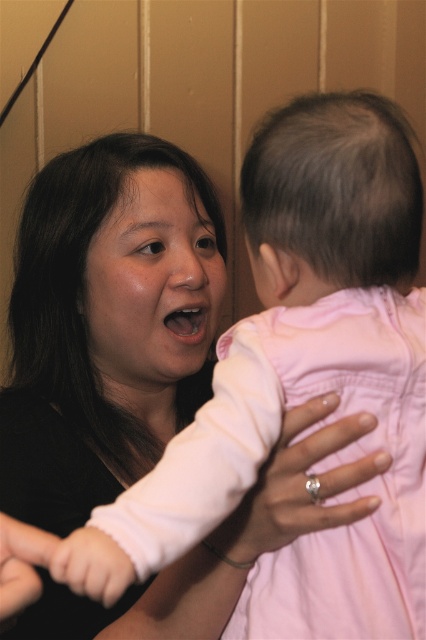
You are a photographer trying to capture a close interaction between two people in the scene. You notice the pink fabric hand at center and the pink fabric baby hand at center. Which hand is wider according to the description?

The pink fabric hand at center is wider than the pink fabric baby hand at center.

You are a tailor measuring fabric pieces for a costume. You have two fabric pieces to compare in the image. The first is the pink fabric arm at center and the second is the pink fabric hand at lower left. Which fabric piece is wider?

The pink fabric arm at center is wider than the pink fabric hand at lower left according to the description.

You are a photographer adjusting your camera to focus on two points in the image. The first point is point (319,484) and the second is point (98,552). Which point is closer to the camera?

Point (319,484) is further to the camera than point (98,552).